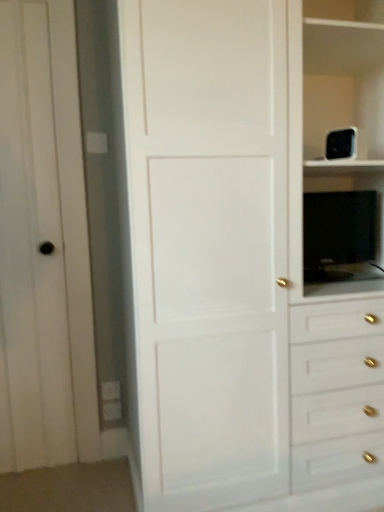
Question: From a real-world perspective, is black glossy tv at right on top of white matte door at center?

Choices:
 (A) yes
 (B) no

Answer: (B)

Question: From a real-world perspective, is black glossy tv at right located beneath white matte door at center?

Choices:
 (A) yes
 (B) no

Answer: (A)

Question: Is black glossy tv at right bigger than white matte door at center?

Choices:
 (A) yes
 (B) no

Answer: (B)

Question: From the image's perspective, is black glossy tv at right on top of white matte door at center?

Choices:
 (A) yes
 (B) no

Answer: (B)

Question: Can you confirm if black glossy tv at right is taller than white matte door at center?

Choices:
 (A) no
 (B) yes

Answer: (A)

Question: Is black glossy tv at right aimed at white matte door at center?

Choices:
 (A) yes
 (B) no

Answer: (A)

Question: Considering the relative positions of white matte door at left and white matte door at center in the image provided, is white matte door at left to the right of white matte door at center from the viewer's perspective?

Choices:
 (A) no
 (B) yes

Answer: (A)

Question: From a real-world perspective, is white matte door at left on white matte door at center?

Choices:
 (A) no
 (B) yes

Answer: (A)

Question: Is white matte door at left behind white matte door at center?

Choices:
 (A) no
 (B) yes

Answer: (B)

Question: Does white matte door at left lie in front of white matte door at center?

Choices:
 (A) yes
 (B) no

Answer: (B)

Question: Does white matte door at left contain white matte door at center?

Choices:
 (A) yes
 (B) no

Answer: (B)

Question: From a real-world perspective, is white matte door at left below white matte door at center?

Choices:
 (A) yes
 (B) no

Answer: (A)

Question: Are white matte door at left and black glossy tv at right beside each other?

Choices:
 (A) yes
 (B) no

Answer: (B)